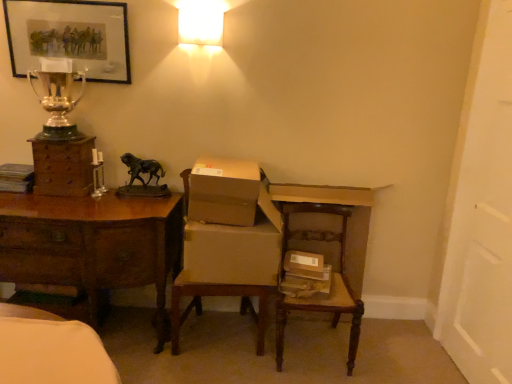
Question: Considering the positions of brown cardboard box at center, the 1th cardboard box from the top, and bronze/statue at center in the image, is brown cardboard box at center, the 1th cardboard box from the top, taller or shorter than bronze/statue at center?

Choices:
 (A) tall
 (B) short

Answer: (A)

Question: Considering the relative positions of brown cardboard box at center, the second cardboard box ordered from the bottom, and bronze/statue at center in the image provided, is brown cardboard box at center, the second cardboard box ordered from the bottom, to the left or to the right of bronze/statue at center?

Choices:
 (A) left
 (B) right

Answer: (B)

Question: Considering the real-world distances, which object is closest to the wooden chest of drawers at left?

Choices:
 (A) brown wood desk at left
 (B) white frosted glass at upper center
 (C) silver polished trophy at upper left
 (D) bronze/statue at center
 (E) wooden swivel chair at lower right

Answer: (C)

Question: Which object is the farthest from the silver polished trophy at upper left?

Choices:
 (A) bronze/statue at center
 (B) wooden swivel chair at lower right
 (C) brown cardboard box at center, the second cardboard box ordered from the bottom
 (D) brown cardboard chair at center
 (E) matte black picture frame at upper left

Answer: (B)